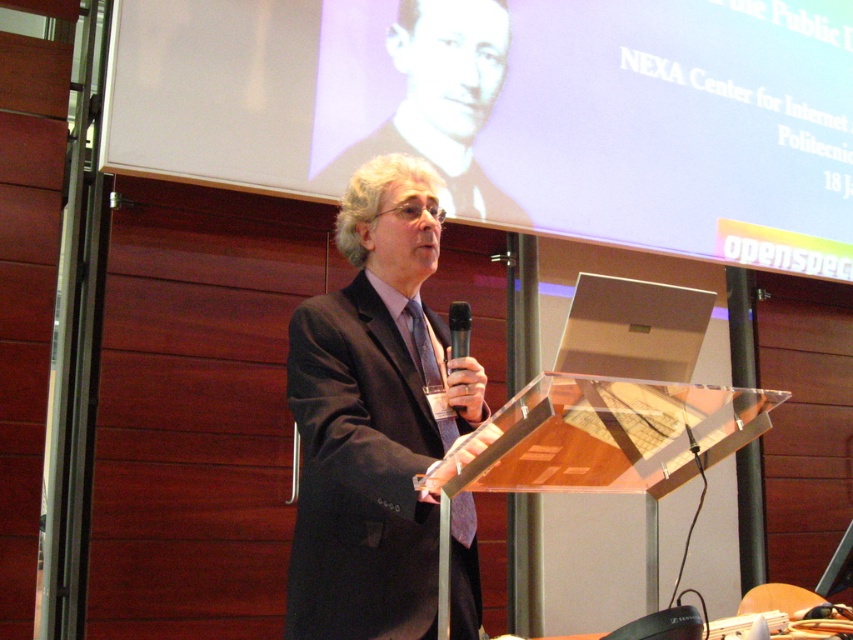
Based on the scene, can you determine if the white matte projection screen at upper center is taller than the matte black suit at center?

Yes, the white matte projection screen at upper center is taller than the matte black suit at center according to the description.

You are a stage technician setting up for a presentation. The presenter needs to adjust the camera so it is exactly 3 meters away from the white matte projection screen at upper center. Based on the current setup, is the camera positioned correctly?

The white matte projection screen at upper center and camera are 2.84 meters apart, so the camera is positioned too close. It needs to be moved an additional 0.16 meters away to reach the required 3 meters distance.